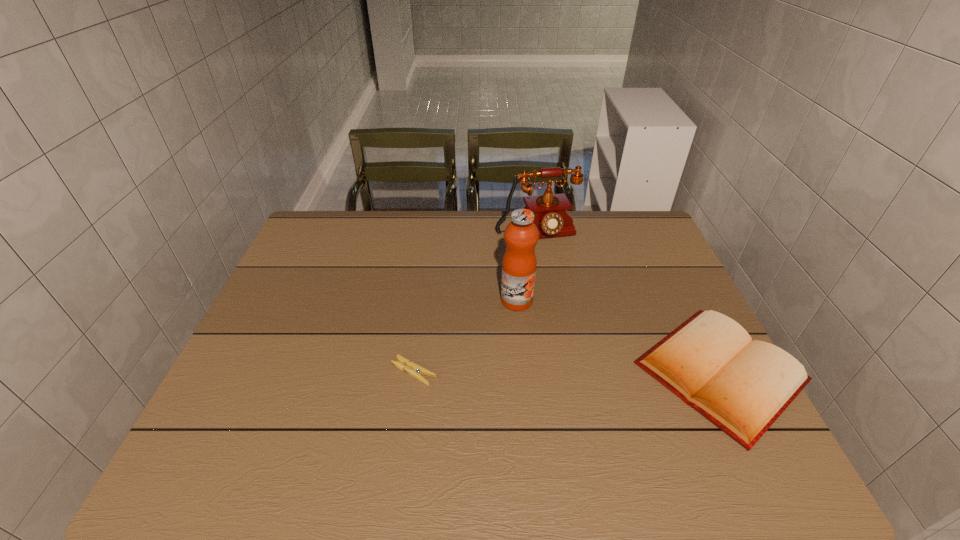
At what (x,y) coordinates should I click in order to perform the action: click on vacant position located on the dial of the second tallest object. Please return your answer as a coordinate pair (x, y). The height and width of the screenshot is (540, 960). Looking at the image, I should click on point(573,308).

Identify the location of free space located 0.240m on the dial of the second tallest object. (568, 298).

Identify the location of blank space located 0.390m on the dial of the second tallest object. The height and width of the screenshot is (540, 960). (588, 338).

This screenshot has height=540, width=960. What are the coordinates of `blank area located 0.120m on the front label of the tallest object` in the screenshot? It's located at (536, 345).

This screenshot has height=540, width=960. What are the coordinates of `vacant area situated on the front label of the tallest object` in the screenshot? It's located at (534, 342).

Locate an element on the screen. The image size is (960, 540). free spot located 0.190m on the front label of the tallest object is located at coordinates (544, 367).

Where is `object located at the far edge`? The image size is (960, 540). object located at the far edge is located at coordinates (552, 219).

You are a GUI agent. You are given a task and a screenshot of the screen. Output one action in this format:
    pyautogui.click(x=<x>, y=<y>)
    Task: Click on the object present at the near edge
    
    Given the screenshot: What is the action you would take?
    pyautogui.click(x=742, y=386)

Where is `object present at the right edge`? The width and height of the screenshot is (960, 540). object present at the right edge is located at coordinates (742, 386).

This screenshot has height=540, width=960. I want to click on object that is at the near right corner, so click(x=742, y=386).